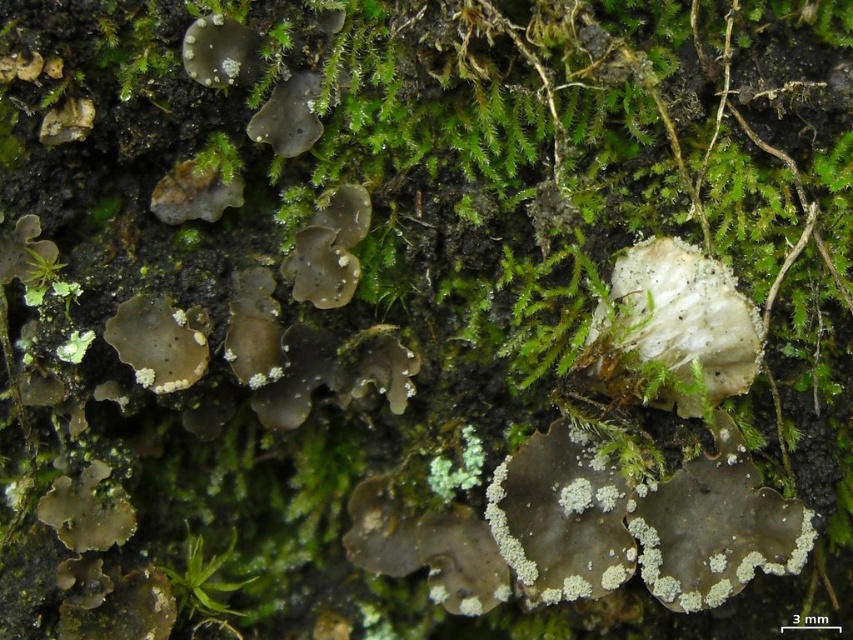
Question: Is brown matte rock at upper left closer to camera compared to green leafy plant at lower left?

Choices:
 (A) no
 (B) yes

Answer: (B)

Question: Can you confirm if brown matte rock at upper left is wider than green leafy plant at lower left?

Choices:
 (A) no
 (B) yes

Answer: (B)

Question: Which object is positioned farthest from the green leafy plant at lower left?

Choices:
 (A) white crustose lichen at center
 (B) translucent gelatinous lichen at lower left
 (C) white powdery lichen at upper left

Answer: (C)

Question: Which object is farther from the camera taking this photo?

Choices:
 (A) green leafy plant at lower left
 (B) brown matte rock at upper left
 (C) white powdery rock at center
 (D) white powdery lichen at upper left

Answer: (A)

Question: Which object appears closest to the camera in this image?

Choices:
 (A) white powdery lichen at upper left
 (B) white crustose lichen at center
 (C) translucent gelatinous lichen at lower left
 (D) white powdery rock at center

Answer: (A)

Question: Can you confirm if translucent gelatinous lichen at lower left is bigger than green leafy plant at lower left?

Choices:
 (A) yes
 (B) no

Answer: (B)